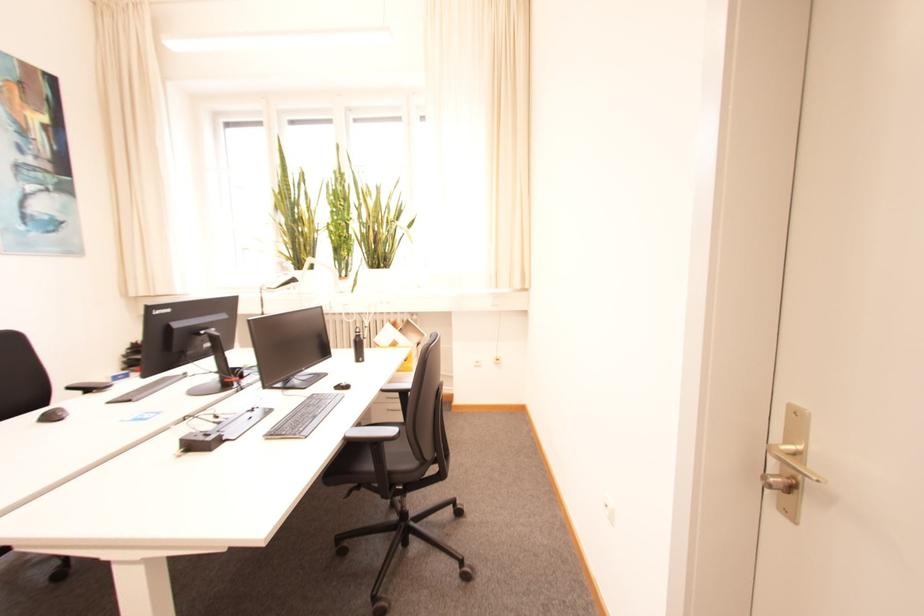
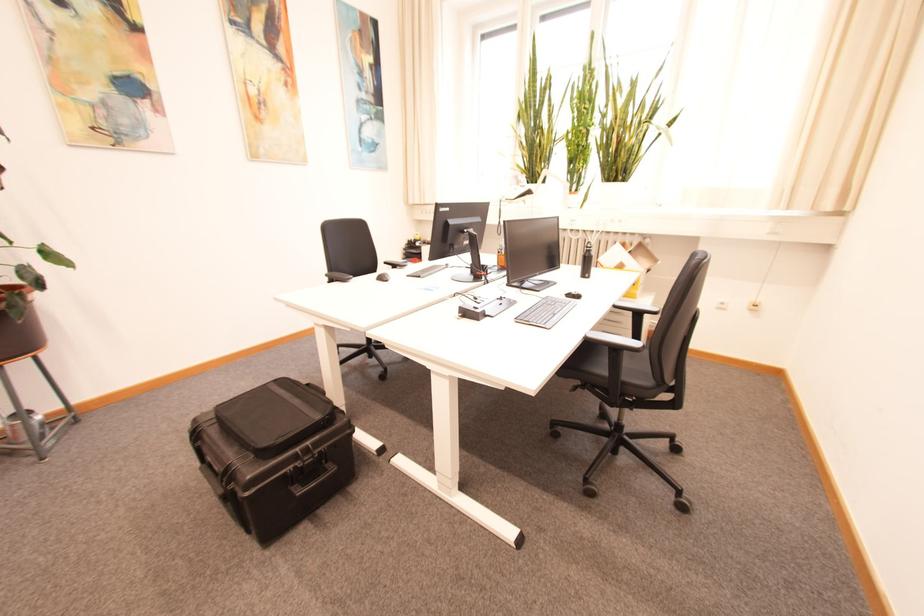
The point at (358, 389) is marked in the first image. Where is the corresponding point in the second image?

(589, 299)